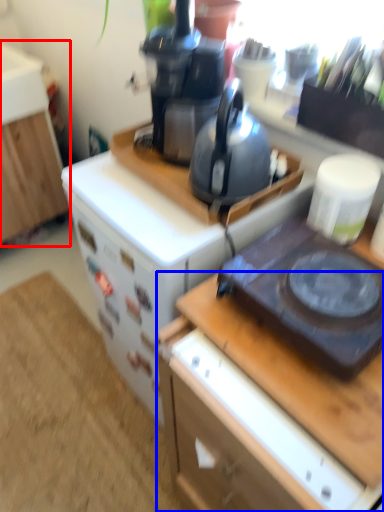
Question: Which of the following is the closest to the observer, cabinetry (highlighted by a red box) or desk (highlighted by a blue box)?

Choices:
 (A) cabinetry
 (B) desk

Answer: (B)